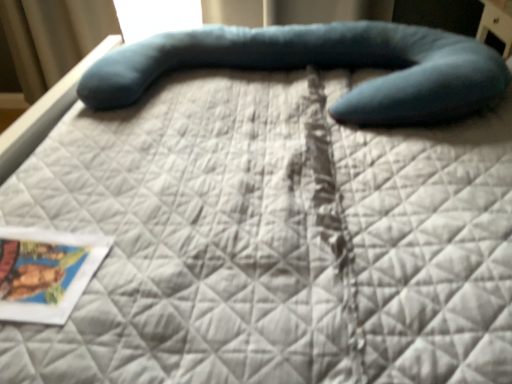
Question: Is teal fabric bean bag chair at center inside or outside of matte paper postcard at lower left?

Choices:
 (A) inside
 (B) outside

Answer: (B)

Question: In the image, is teal fabric bean bag chair at center positioned in front of or behind matte paper postcard at lower left?

Choices:
 (A) behind
 (B) front

Answer: (A)

Question: Is point (241, 43) positioned closer to the camera than point (31, 299)?

Choices:
 (A) closer
 (B) farther

Answer: (B)

Question: Is matte paper postcard at lower left situated inside teal fabric bean bag chair at center or outside?

Choices:
 (A) inside
 (B) outside

Answer: (B)

Question: In terms of height, does matte paper postcard at lower left look taller or shorter compared to teal fabric bean bag chair at center?

Choices:
 (A) short
 (B) tall

Answer: (A)

Question: From a real-world perspective, relative to teal fabric bean bag chair at center, is matte paper postcard at lower left vertically above or below?

Choices:
 (A) below
 (B) above

Answer: (A)

Question: Does point (73, 301) appear closer or farther from the camera than point (434, 54)?

Choices:
 (A) closer
 (B) farther

Answer: (A)